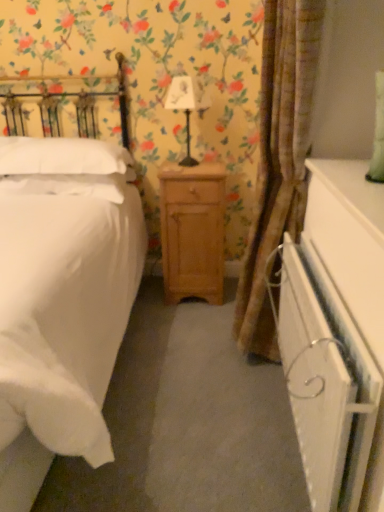
Where is `free space to the back side of brown textured curtain at center`? free space to the back side of brown textured curtain at center is located at coordinates (204, 325).